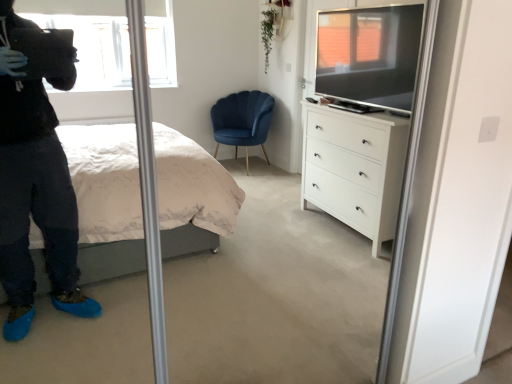
Identify the location of white glossy chest of drawers at right. Image resolution: width=512 pixels, height=384 pixels. (355, 168).

What do you see at coordinates (355, 168) in the screenshot?
I see `white glossy chest of drawers at right` at bounding box center [355, 168].

Measure the distance between white glossy chest of drawers at right and camera.

2.65 meters.

Locate an element on the screen. The image size is (512, 384). white glossy chest of drawers at right is located at coordinates (355, 168).